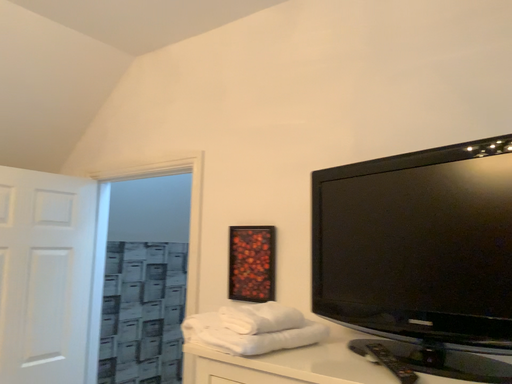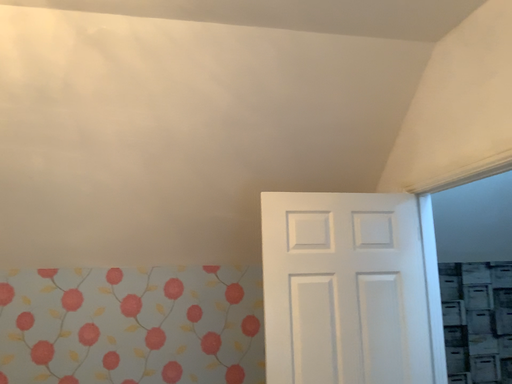
Question: How did the camera likely rotate when shooting the video?

Choices:
 (A) rotated left
 (B) rotated right

Answer: (A)